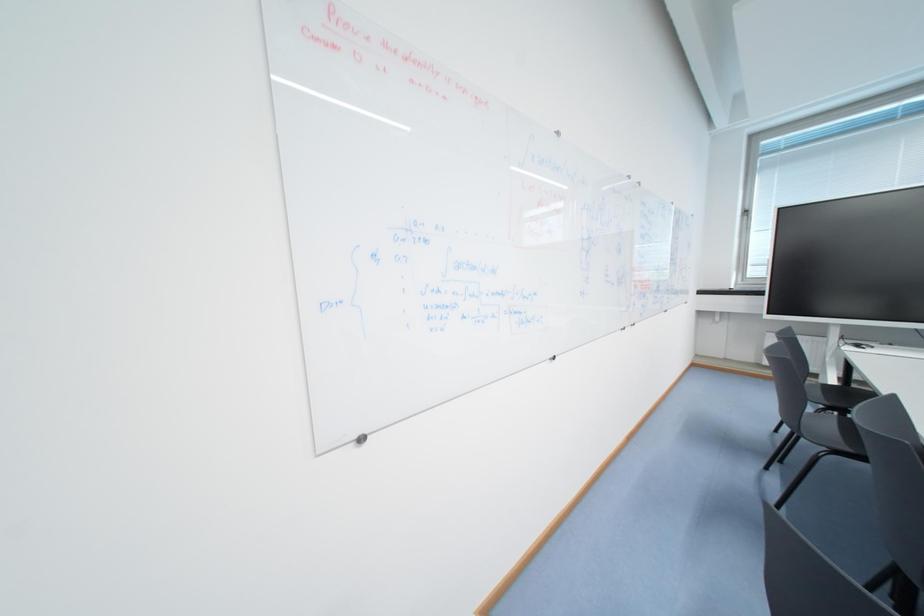
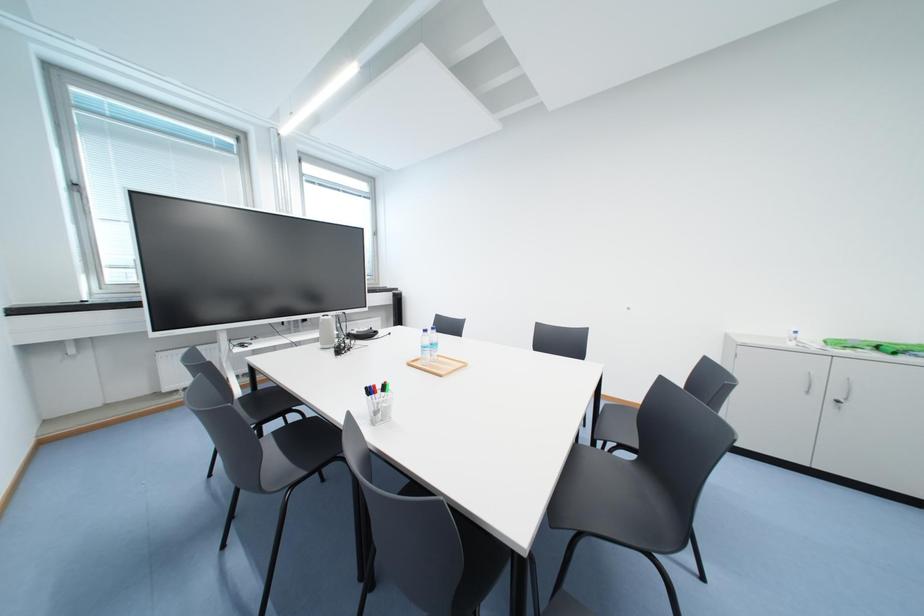
Question: The camera is either moving clockwise (left) or counter-clockwise (right) around the object. The first image is from the beginning of the video and the second image is from the end. Is the camera moving left or right when shooting the video?

Choices:
 (A) Left
 (B) Right

Answer: (A)